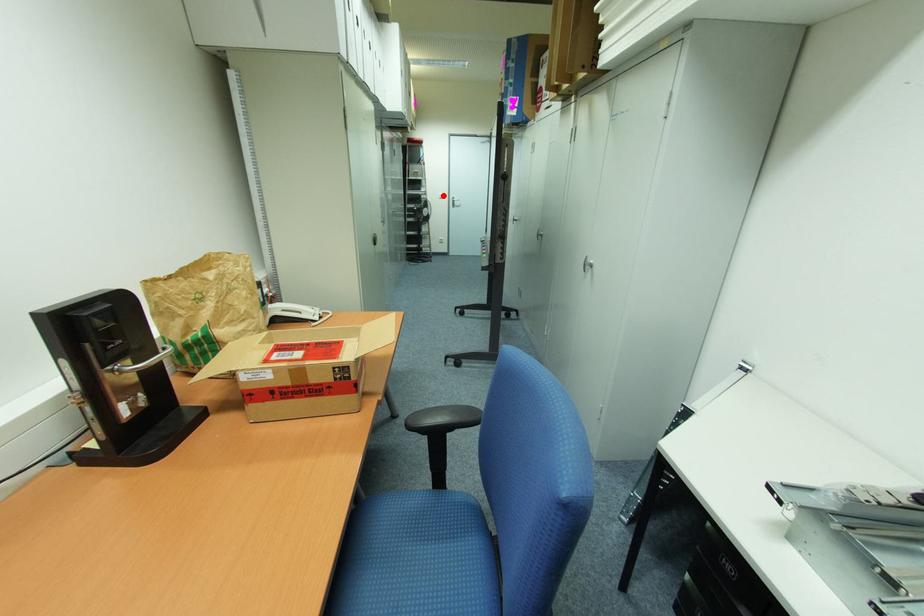
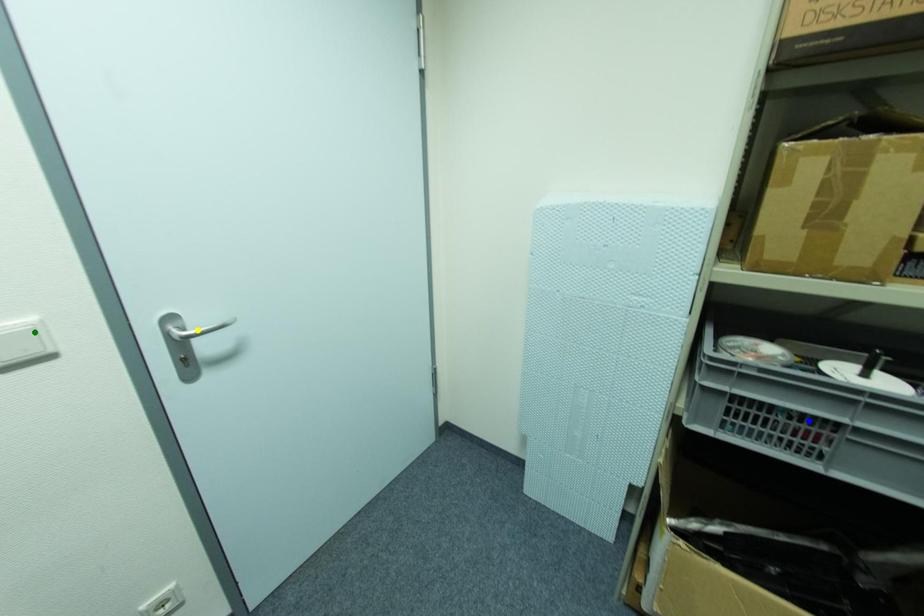
Question: I am providing you with two images of the same scene from different viewpoints. A red point is marked on the first image. You are given multiple points on the second image. Can you choose the point in image 2 that corresponds to the point in image 1?

Choices:
 (A) green point
 (B) blue point
 (C) yellow point

Answer: (A)